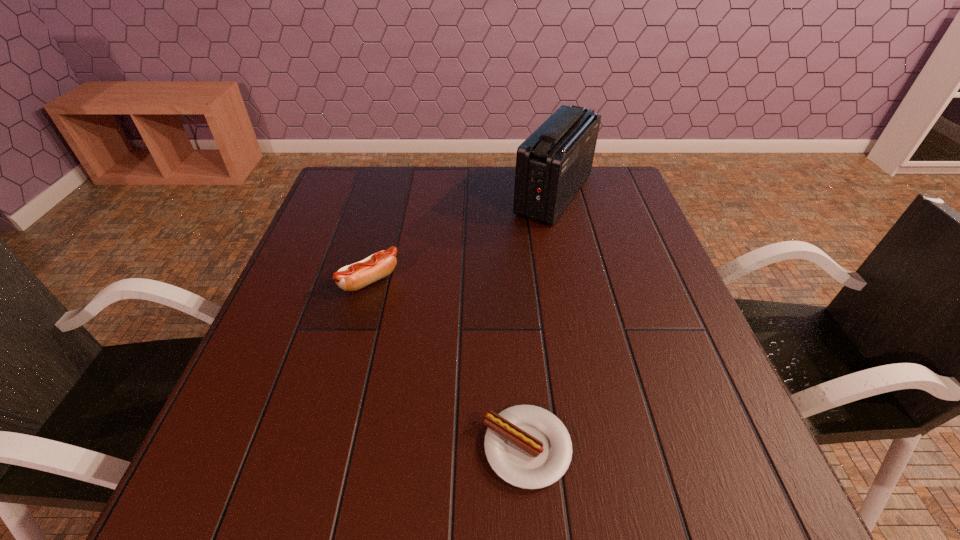
The width and height of the screenshot is (960, 540). In order to click on free space at the far left corner of the desktop in this screenshot , I will do `click(354, 197)`.

Where is `blank area at the far right corner`? The height and width of the screenshot is (540, 960). blank area at the far right corner is located at coordinates (618, 200).

The width and height of the screenshot is (960, 540). Find the location of `free space between the nearer sausage and the tallest object`. free space between the nearer sausage and the tallest object is located at coordinates (540, 321).

Where is `free space between the second shortest object and the nearest object`? The height and width of the screenshot is (540, 960). free space between the second shortest object and the nearest object is located at coordinates (448, 364).

Locate an element on the screen. Image resolution: width=960 pixels, height=540 pixels. free space between the shortest object and the farthest object is located at coordinates (540, 321).

Identify the location of free space that is in between the farthest object and the nearest object. This screenshot has width=960, height=540. (540, 321).

Image resolution: width=960 pixels, height=540 pixels. I want to click on vacant space in between the nearest object and the radio receiver, so click(540, 321).

At what (x,y) coordinates should I click in order to perform the action: click on empty space that is in between the radio receiver and the shortest object. Please return your answer as a coordinate pair (x, y). This screenshot has height=540, width=960. Looking at the image, I should click on (540, 321).

Find the location of a particular element. empty space that is in between the second shortest object and the nearest object is located at coordinates (448, 364).

Find the location of `unoccupied position between the radio receiver and the farther sausage`. unoccupied position between the radio receiver and the farther sausage is located at coordinates (462, 238).